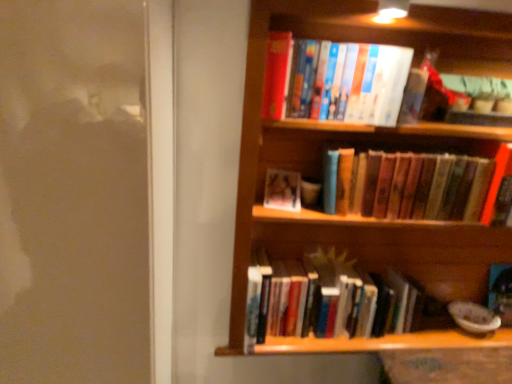
Question: In which direction should I rotate to look at hardcover books at center, acting as the second book starting from the top?

Choices:
 (A) right
 (B) left

Answer: (A)

Question: Is hardcover books at upper center, which is counted as the 1th book, starting from the top, oriented towards matte plastic photo frame at center, acting as the second book starting from the bottom?

Choices:
 (A) yes
 (B) no

Answer: (B)

Question: Does hardcover books at upper center, the 4th book ordered from the bottom, have a smaller size compared to matte plastic photo frame at center, the third book viewed from the top?

Choices:
 (A) no
 (B) yes

Answer: (A)

Question: Does hardcover books at upper center, the 4th book ordered from the bottom, lie behind matte plastic photo frame at center, the third book viewed from the top?

Choices:
 (A) no
 (B) yes

Answer: (A)

Question: Would you consider hardcover books at upper center, which is counted as the 1th book, starting from the top, to be distant from matte plastic photo frame at center, the third book viewed from the top?

Choices:
 (A) no
 (B) yes

Answer: (A)

Question: Is hardcover books at upper center, the 4th book ordered from the bottom, positioned in front of matte plastic photo frame at center, acting as the second book starting from the bottom?

Choices:
 (A) yes
 (B) no

Answer: (A)

Question: From the image's perspective, is hardcover books at upper center, which is counted as the 1th book, starting from the top, over matte plastic photo frame at center, acting as the second book starting from the bottom?

Choices:
 (A) yes
 (B) no

Answer: (A)

Question: Is matte plastic photo frame at center, acting as the second book starting from the bottom, at the left side of wooden bookshelf at upper right?

Choices:
 (A) no
 (B) yes

Answer: (B)

Question: From the image's perspective, is matte plastic photo frame at center, the third book viewed from the top, below wooden bookshelf at upper right?

Choices:
 (A) yes
 (B) no

Answer: (B)

Question: Is wooden bookshelf at upper right surrounded by matte plastic photo frame at center, the third book viewed from the top?

Choices:
 (A) no
 (B) yes

Answer: (A)

Question: Is matte plastic photo frame at center, the third book viewed from the top, not near wooden bookshelf at upper right?

Choices:
 (A) no
 (B) yes

Answer: (A)

Question: Can you confirm if matte plastic photo frame at center, acting as the second book starting from the bottom, is positioned to the right of wooden bookshelf at upper right?

Choices:
 (A) no
 (B) yes

Answer: (A)

Question: Does matte plastic photo frame at center, the third book viewed from the top, have a lesser height compared to wooden bookshelf at upper right?

Choices:
 (A) no
 (B) yes

Answer: (B)

Question: From a real-world perspective, is matte plastic photo frame at center, acting as the second book starting from the bottom, on hardcover books at upper center, which is counted as the 1th book, starting from the top?

Choices:
 (A) no
 (B) yes

Answer: (A)